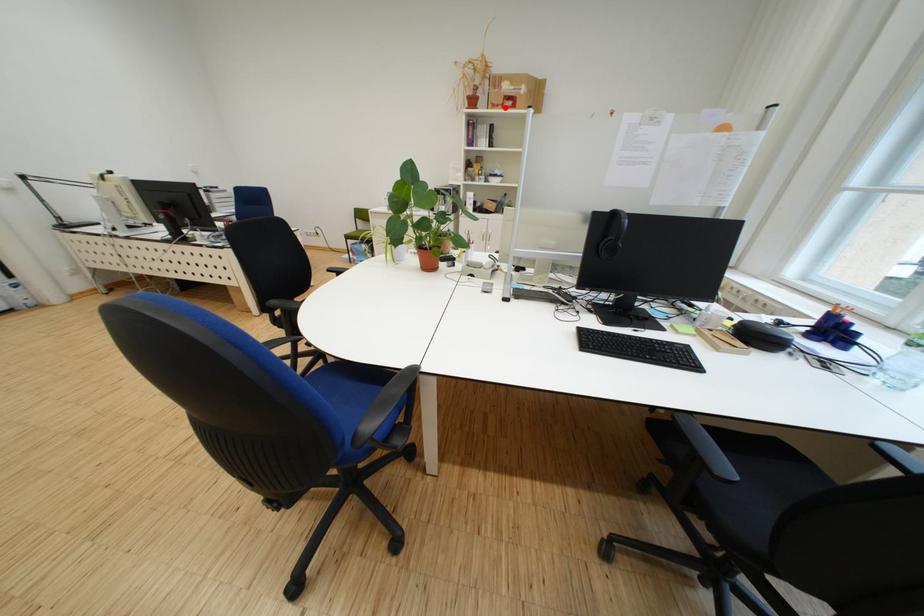
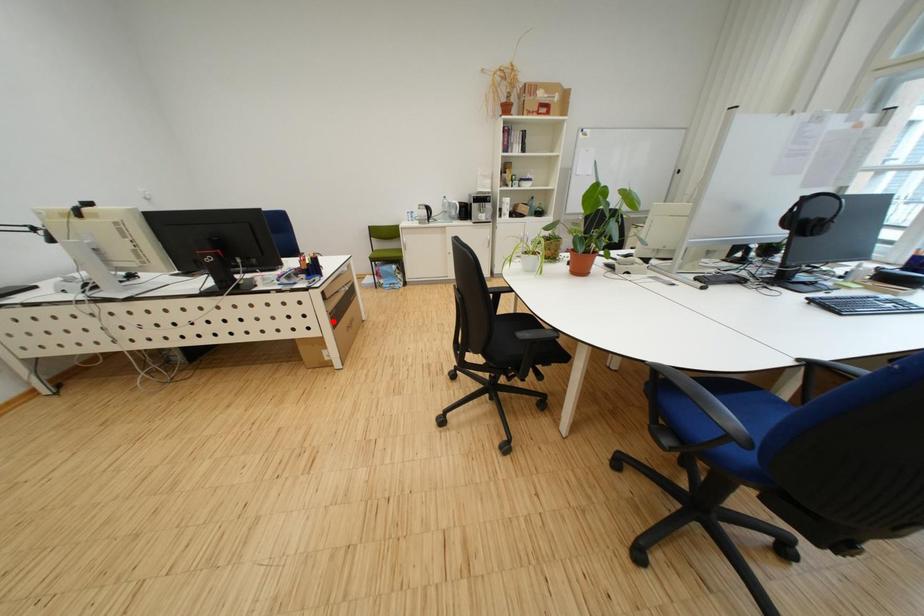
I am providing you with two images of the same scene from different viewpoints. A red point is marked on the first image and another point is marked on the second image. Does the point marked in image1 correspond to the same location as the one in image2?

No